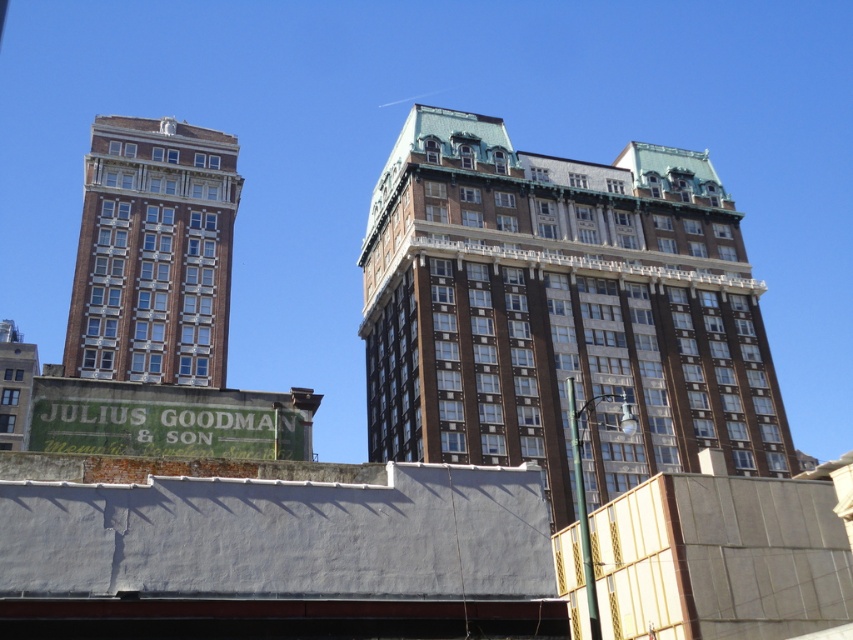
Is brown brick building at center further to the viewer compared to brown brick building at left?

Yes, brown brick building at center is behind brown brick building at left.

Is the position of brown brick building at center less distant than that of brown brick building at left?

No, it is not.

In order to click on brown brick building at center in this screenshot , I will do (561, 310).

This screenshot has width=853, height=640. I want to click on brown brick building at center, so click(561, 310).